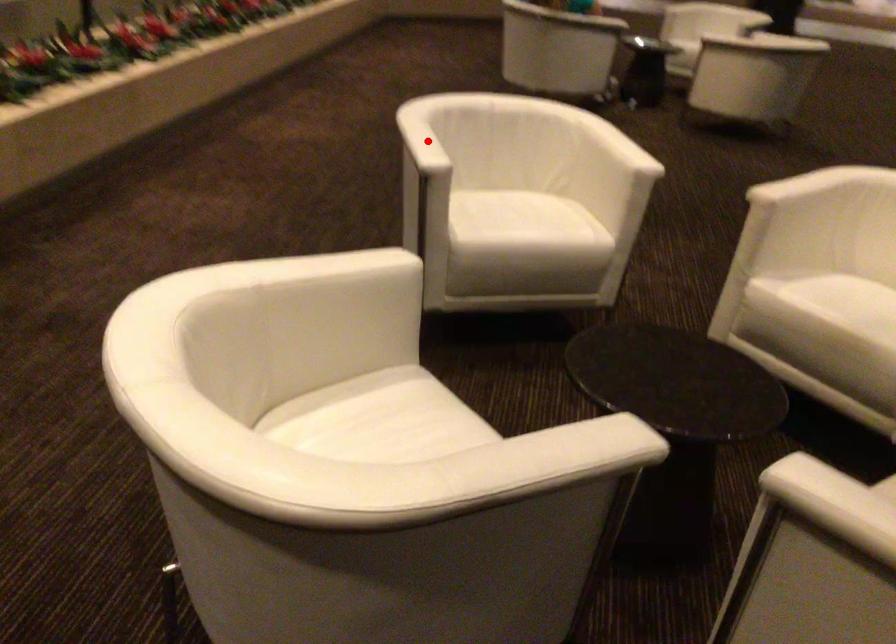
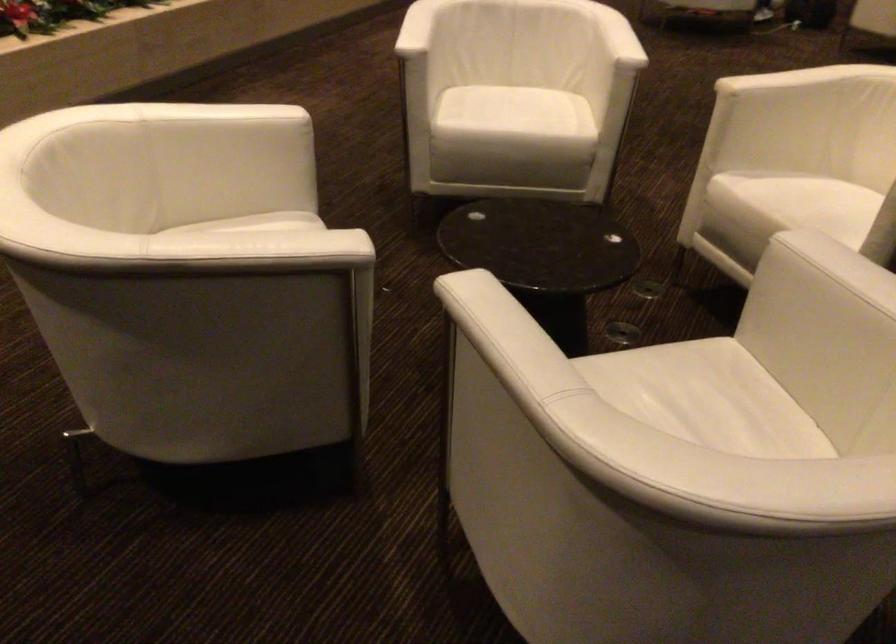
Where in the second image is the point corresponding to the highlighted location from the first image?

(417, 28)